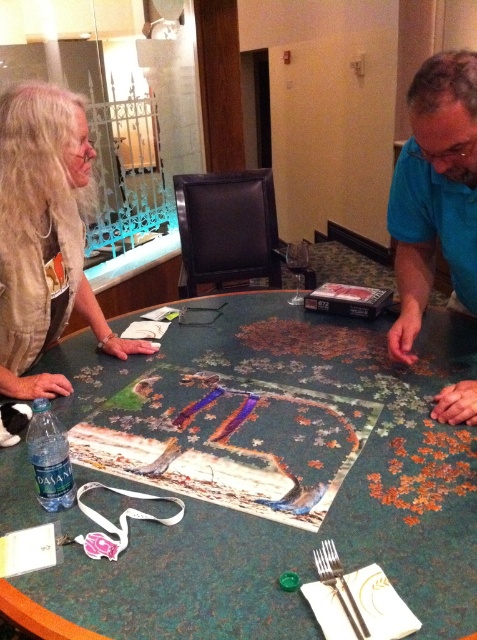
You are standing 30 inches away from the table where the puzzle is being assembled. If you want to reach the point at coordinates point (111, 628), will you be able to reach it without moving closer?

The distance of point (111, 628) from viewer is 29.41 inches, so yes, you can reach it without moving closer since you are already 30 inches away.

You are trying to place a large puzzle piece on the table. Given that the green marble table at center is wider than the long blonde hair at upper left, can you estimate the table width relative to the hair length?

The green marble table at center is wider than the long blonde hair at upper left.